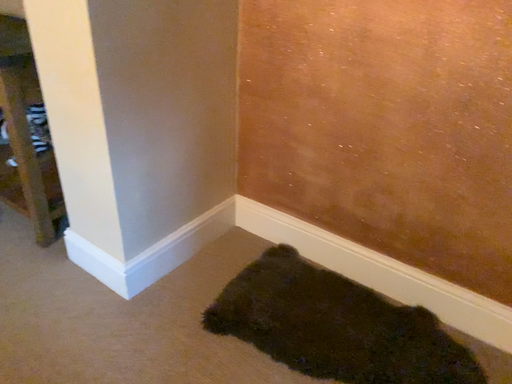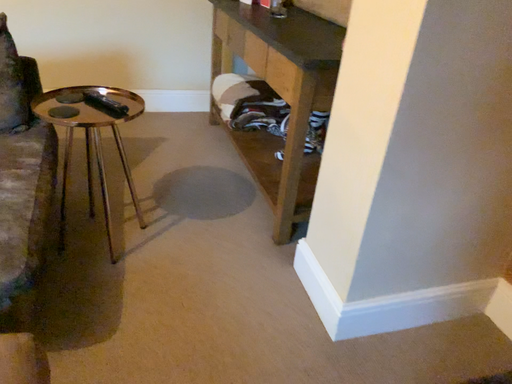
Question: How did the camera likely rotate when shooting the video?

Choices:
 (A) rotated upward
 (B) rotated downward

Answer: (A)